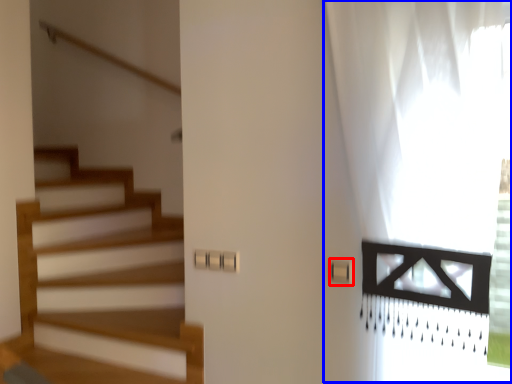
Question: Which point is further to the camera, light switch (highlighted by a red box) or curtain (highlighted by a blue box)?

Choices:
 (A) light switch
 (B) curtain

Answer: (A)